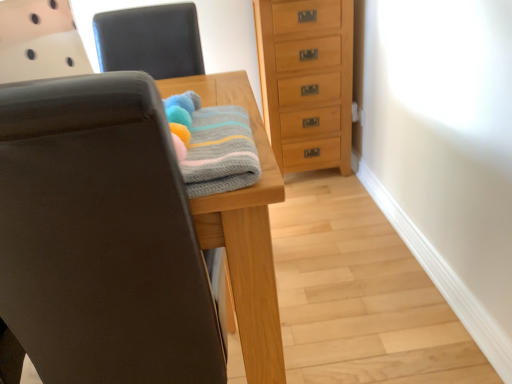
Question: Is knitted cotton towel at center wider than leather-like black chair at upper center, which appears as the 1th chair when viewed from the top?

Choices:
 (A) no
 (B) yes

Answer: (B)

Question: Is the depth of knitted cotton towel at center less than that of leather-like black chair at upper center, which appears as the 1th chair when viewed from the top?

Choices:
 (A) no
 (B) yes

Answer: (B)

Question: Is knitted cotton towel at center facing towards leather-like black chair at upper center, which appears as the 1th chair when viewed from the top?

Choices:
 (A) no
 (B) yes

Answer: (B)

Question: From the image's perspective, is knitted cotton towel at center below leather-like black chair at upper center, which appears as the 1th chair when viewed from the top?

Choices:
 (A) yes
 (B) no

Answer: (A)

Question: Would you say knitted cotton towel at center contains leather-like black chair at upper center, which appears as the second chair when ordered from the bottom?

Choices:
 (A) no
 (B) yes

Answer: (A)

Question: In terms of size, does matte black chair at left, placed as the first chair when sorted from bottom to top, appear bigger or smaller than light brown wood chest of drawers at center right?

Choices:
 (A) big
 (B) small

Answer: (A)

Question: In the image, is matte black chair at left, arranged as the 2th chair when viewed from the top, positioned in front of or behind light brown wood chest of drawers at center right?

Choices:
 (A) front
 (B) behind

Answer: (A)

Question: From the image's perspective, is matte black chair at left, placed as the first chair when sorted from bottom to top, positioned above or below light brown wood chest of drawers at center right?

Choices:
 (A) below
 (B) above

Answer: (A)

Question: From a real-world perspective, is matte black chair at left, arranged as the 2th chair when viewed from the top, above or below light brown wood chest of drawers at center right?

Choices:
 (A) below
 (B) above

Answer: (B)

Question: From a real-world perspective, relative to matte black chair at left, arranged as the 2th chair when viewed from the top, is leather-like black chair at upper center, which appears as the second chair when ordered from the bottom, vertically above or below?

Choices:
 (A) below
 (B) above

Answer: (B)

Question: Do you think leather-like black chair at upper center, which appears as the 1th chair when viewed from the top, is within matte black chair at left, arranged as the 2th chair when viewed from the top, or outside of it?

Choices:
 (A) outside
 (B) inside

Answer: (A)

Question: Based on their positions, is leather-like black chair at upper center, which appears as the 1th chair when viewed from the top, located to the left or right of matte black chair at left, placed as the first chair when sorted from bottom to top?

Choices:
 (A) left
 (B) right

Answer: (A)

Question: From their relative heights in the image, would you say leather-like black chair at upper center, which appears as the second chair when ordered from the bottom, is taller or shorter than matte black chair at left, arranged as the 2th chair when viewed from the top?

Choices:
 (A) short
 (B) tall

Answer: (A)

Question: From the image's perspective, is matte black chair at left, placed as the first chair when sorted from bottom to top, above or below knitted cotton towel at center?

Choices:
 (A) above
 (B) below

Answer: (B)

Question: From a real-world perspective, is matte black chair at left, placed as the first chair when sorted from bottom to top, above or below knitted cotton towel at center?

Choices:
 (A) below
 (B) above

Answer: (A)